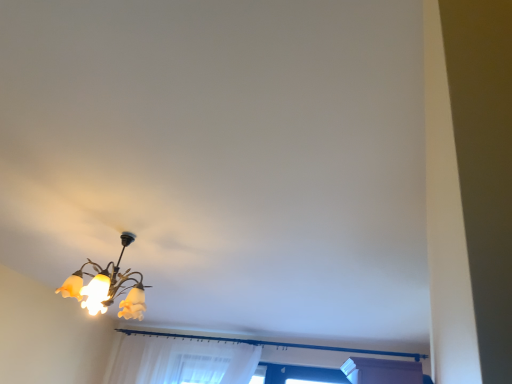
Where is `matte glass chandelier at upper left`? matte glass chandelier at upper left is located at coordinates (108, 287).

Describe the element at coordinates (108, 287) in the screenshot. This screenshot has height=384, width=512. I see `matte glass chandelier at upper left` at that location.

The height and width of the screenshot is (384, 512). What are the coordinates of `matte glass chandelier at upper left` in the screenshot? It's located at (108, 287).